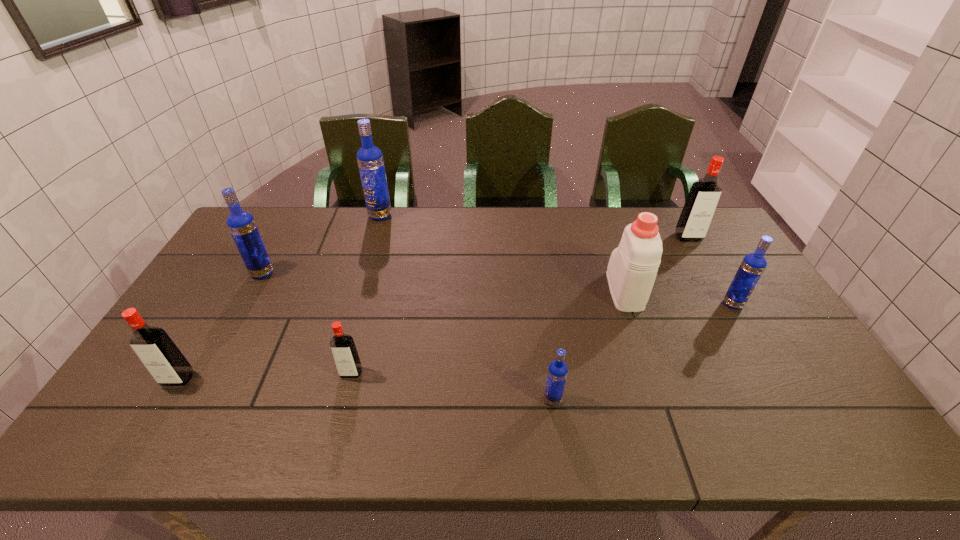
This screenshot has height=540, width=960. In order to click on vacant region located on the left of the second nearest blue vodka in this screenshot , I will do `click(601, 304)`.

At what (x,y) coordinates should I click in order to perform the action: click on free point located on the front and back of the second smallest red vodka. Please return your answer as a coordinate pair (x, y). The image size is (960, 540). Looking at the image, I should click on (137, 446).

Identify the location of free space located on the right of the third blue vodka from left to right. The image size is (960, 540). (620, 400).

Locate an element on the screen. The width and height of the screenshot is (960, 540). vacant area situated on the front and back of the smallest red vodka is located at coordinates [335, 435].

The image size is (960, 540). In order to click on object that is at the far right corner in this screenshot , I will do `click(699, 208)`.

The height and width of the screenshot is (540, 960). I want to click on vacant space at the far edge of the desktop, so click(x=442, y=208).

In the image, there is a desktop. Where is `vacant space at the left edge`? vacant space at the left edge is located at coordinates (159, 395).

Locate an element on the screen. The height and width of the screenshot is (540, 960). vacant point at the near left corner is located at coordinates (144, 430).

At what (x,y) coordinates should I click in order to perform the action: click on free space between the nearest blue vodka and the sixth object from left to right. Please return your answer as a coordinate pair (x, y). Image resolution: width=960 pixels, height=540 pixels. Looking at the image, I should click on (588, 345).

This screenshot has width=960, height=540. In order to click on blank region between the second red vodka from right to left and the leftmost red vodka in this screenshot , I will do `click(264, 376)`.